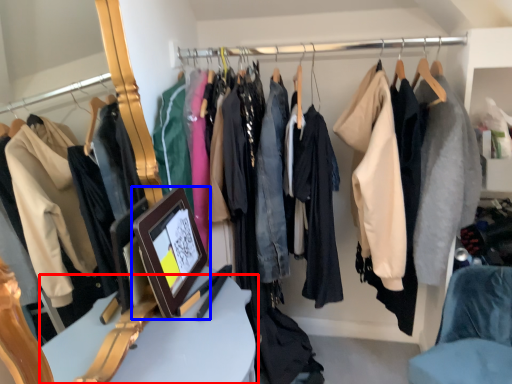
Question: Which point is closer to the camera, furniture (highlighted by a red box) or picture frame (highlighted by a blue box)?

Choices:
 (A) furniture
 (B) picture frame

Answer: (A)